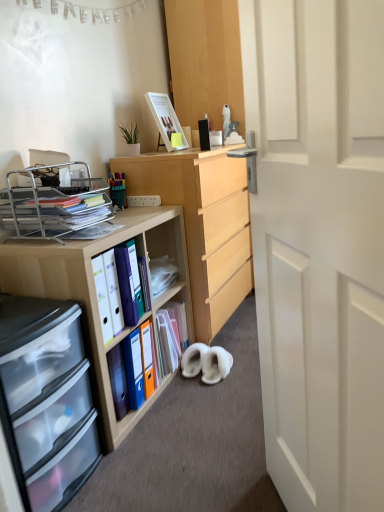
Question: Is metallic silver organizer at left bigger than clear plastic drawers at lower left?

Choices:
 (A) no
 (B) yes

Answer: (A)

Question: Is metallic silver organizer at left thinner than clear plastic drawers at lower left?

Choices:
 (A) yes
 (B) no

Answer: (B)

Question: Considering the relative positions of metallic silver organizer at left and clear plastic drawers at lower left in the image provided, is metallic silver organizer at left in front of clear plastic drawers at lower left?

Choices:
 (A) yes
 (B) no

Answer: (B)

Question: Is metallic silver organizer at left at the right side of clear plastic drawers at lower left?

Choices:
 (A) no
 (B) yes

Answer: (A)

Question: From a real-world perspective, is metallic silver organizer at left positioned under clear plastic drawers at lower left based on gravity?

Choices:
 (A) yes
 (B) no

Answer: (B)

Question: Would you say wooden desk at left, the 2th desk viewed from the back, is inside or outside matte plastic folder at center, positioned as the first book in back-to-front order?

Choices:
 (A) outside
 (B) inside

Answer: (A)

Question: In terms of width, does wooden desk at left, which ranks as the first desk in front-to-back order, look wider or thinner when compared to matte plastic folder at center, positioned as the first book in back-to-front order?

Choices:
 (A) wide
 (B) thin

Answer: (A)

Question: Is point (163, 246) positioned closer to the camera than point (173, 357)?

Choices:
 (A) farther
 (B) closer

Answer: (A)

Question: From a real-world perspective, is wooden desk at left, which ranks as the first desk in front-to-back order, positioned above or below matte plastic folder at center, positioned as the first book in back-to-front order?

Choices:
 (A) below
 (B) above

Answer: (B)

Question: Considering their positions, is white matte door at center located in front of or behind white suede slippers at lower center, which ranks as the second footwear in right-to-left order?

Choices:
 (A) front
 (B) behind

Answer: (A)

Question: Is white matte door at center bigger or smaller than white suede slippers at lower center, which is the 1th footwear from left to right?

Choices:
 (A) big
 (B) small

Answer: (A)

Question: Based on their positions, is white matte door at center located to the left or right of white suede slippers at lower center, which ranks as the second footwear in right-to-left order?

Choices:
 (A) right
 (B) left

Answer: (A)

Question: In terms of width, does white matte door at center look wider or thinner when compared to white suede slippers at lower center, which is the 1th footwear from left to right?

Choices:
 (A) thin
 (B) wide

Answer: (A)

Question: From a real-world perspective, is matte plastic folders at center left, marked as the 2th book in a back-to-front arrangement, above or below matte wooden picture frame at upper center?

Choices:
 (A) below
 (B) above

Answer: (A)

Question: Is matte plastic folders at center left, the 1th book in the front-to-back sequence, inside or outside of matte wooden picture frame at upper center?

Choices:
 (A) outside
 (B) inside

Answer: (A)